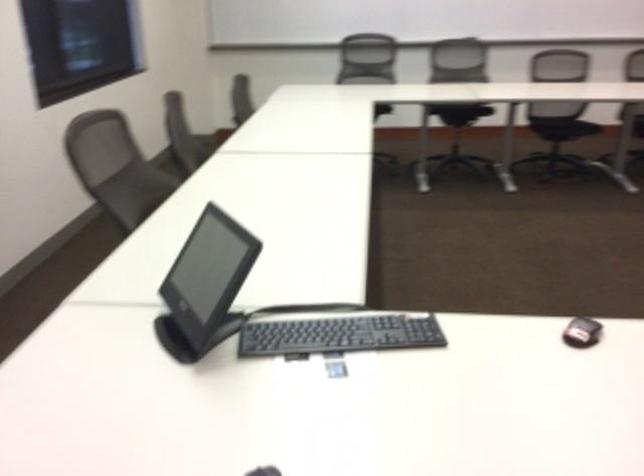
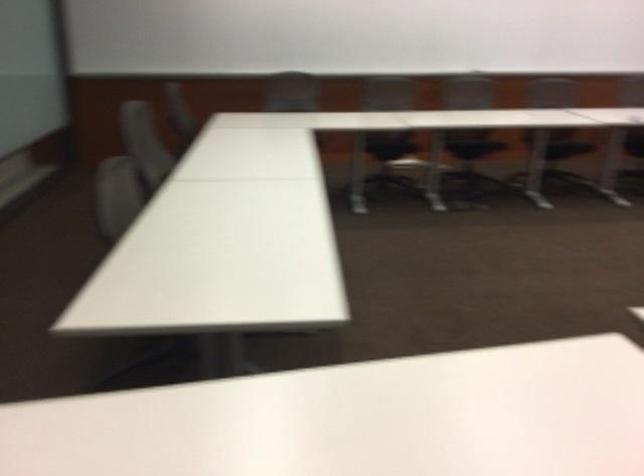
Question: The images are taken continuously from a first-person perspective. In which direction are you moving?

Choices:
 (A) Left
 (B) Right
 (C) Forward
 (D) Backward

Answer: (D)